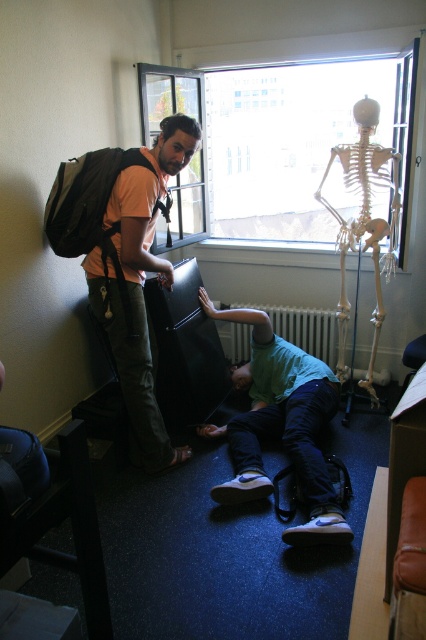
You are standing in the room and want to see outside through the transparent glass window at upper center. Which direction should you turn your head from the green matte shirt at lower center?

The transparent glass window at upper center is positioned on the right side of green matte shirt at lower center, so you should turn your head to the right to see outside through the transparent glass window at upper center.